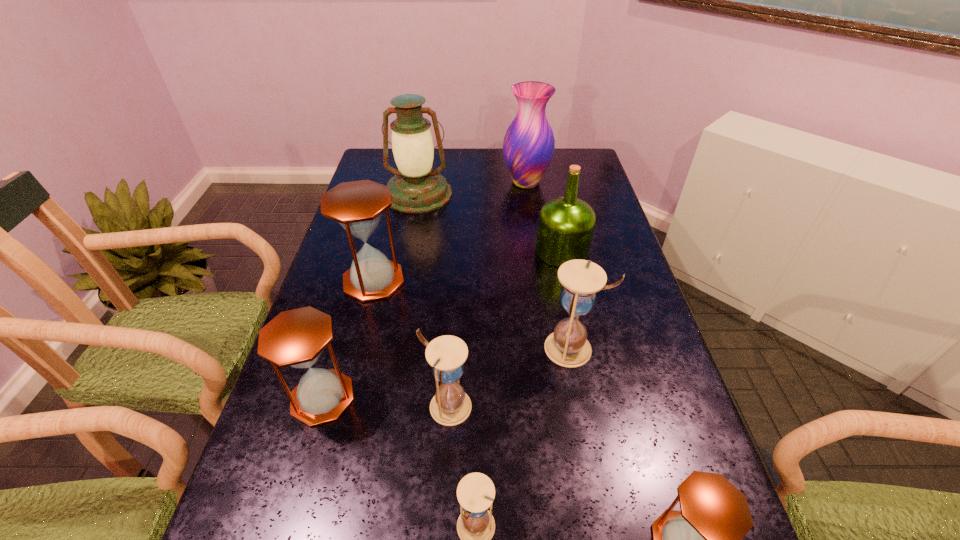
In order to click on hourglass located at the right edge in this screenshot , I will do `click(567, 346)`.

Find the location of `object present at the far left corner`. object present at the far left corner is located at coordinates pyautogui.click(x=416, y=188).

Find the location of `blank space at the far edge of the desktop`. blank space at the far edge of the desktop is located at coordinates (552, 176).

Where is `vacant space at the left edge`? vacant space at the left edge is located at coordinates (343, 229).

Where is `free point at the right edge`? free point at the right edge is located at coordinates (559, 180).

You are a GUI agent. You are given a task and a screenshot of the screen. Output one action in this format:
    pyautogui.click(x=<x>, y=<y>)
    Task: Click on the vacant space at the far left corner of the desktop
    This screenshot has width=960, height=540.
    Given the screenshot: What is the action you would take?
    pyautogui.click(x=376, y=157)

At what (x,y) coordinates should I click in order to perform the action: click on vacant point at the far right corner. Please return your answer as a coordinate pair (x, y). Image resolution: width=960 pixels, height=540 pixels. Looking at the image, I should click on (581, 163).

In order to click on vacant area between the farthest brown hourglass and the vase in this screenshot , I will do `click(450, 232)`.

Locate an element on the screen. The width and height of the screenshot is (960, 540). vacant region between the second smallest brown hourglass and the purple vase is located at coordinates (424, 290).

This screenshot has width=960, height=540. Identify the location of free spot between the lantern and the purple vase. (472, 188).